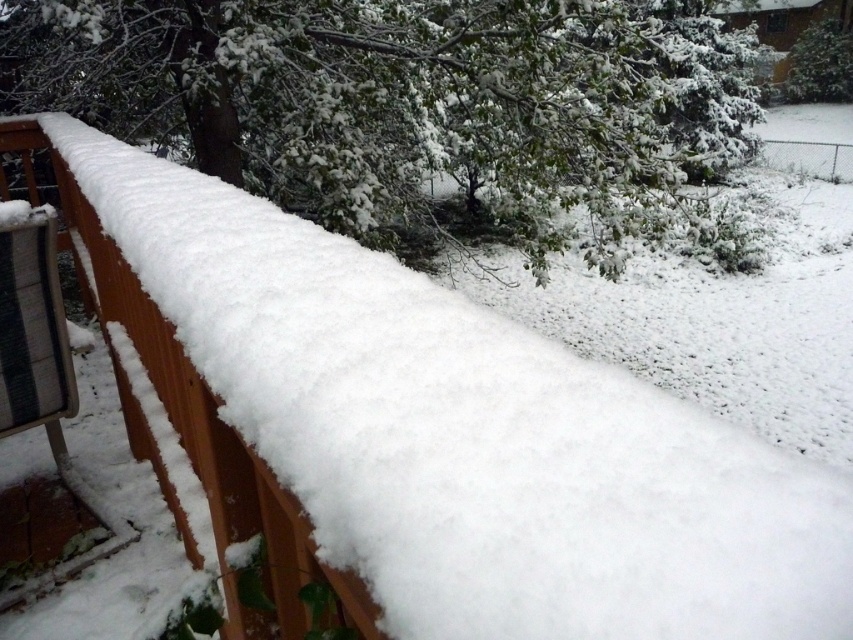
You are standing on the wooden railing in the winter scene. Looking around, you see a point marked at coordinates (407, 100). What object does this point indicate?

The point at coordinates (407, 100) indicates the white snow covered tree at upper center.